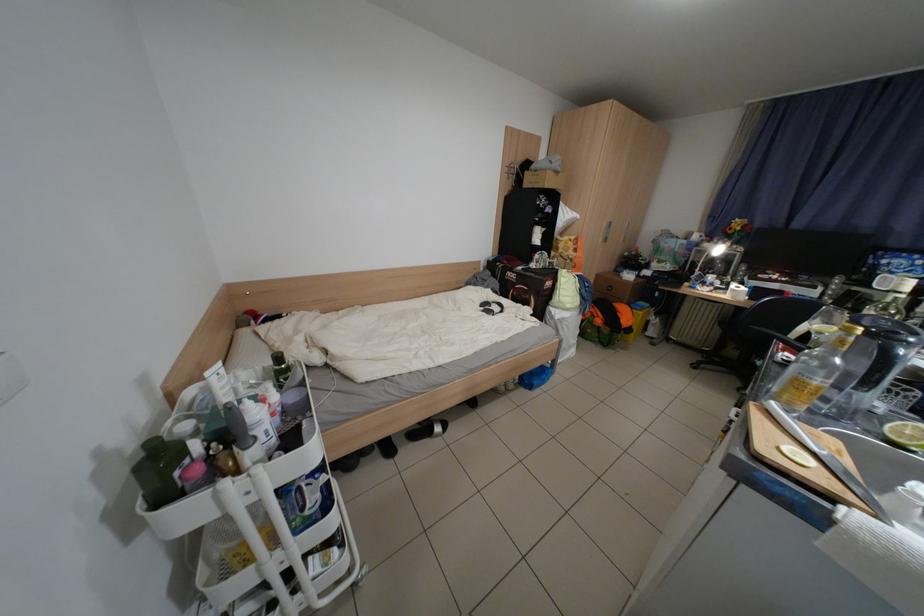
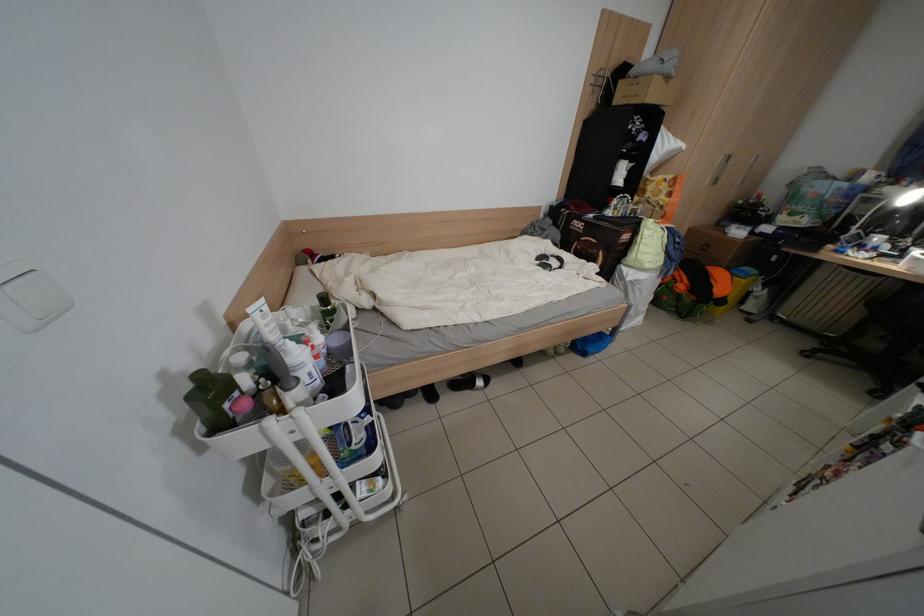
The point at (149, 471) is marked in the first image. Where is the corresponding point in the second image?

(201, 399)